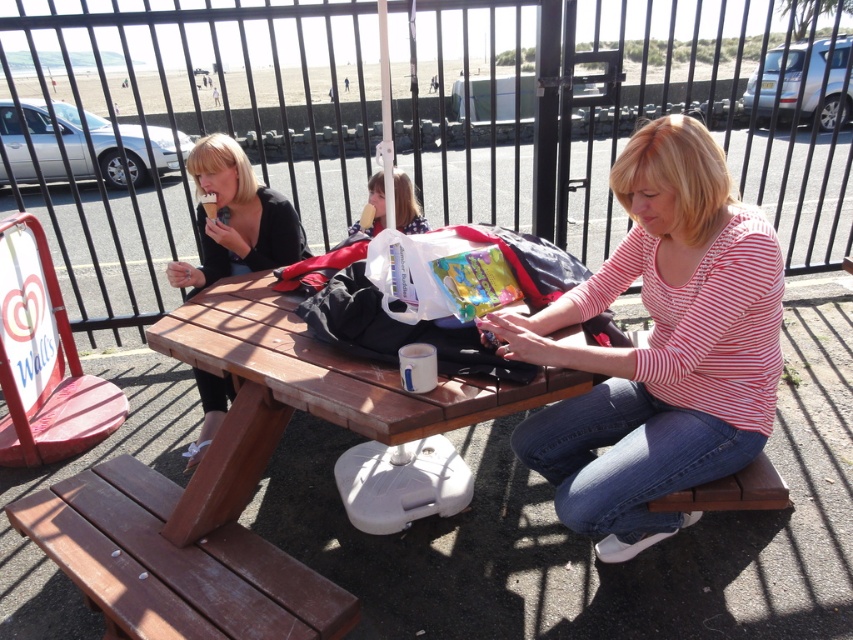
Between striped cotton shirt at center and brown wooden picnic table at center, which one is positioned higher?

striped cotton shirt at center is above.

Looking at this image, is striped cotton shirt at center bigger than brown wooden picnic table at center?

Incorrect, striped cotton shirt at center is not larger than brown wooden picnic table at center.

Between point (589, 468) and point (329, 394), which one is positioned behind?

Positioned behind is point (589, 468).

Identify the location of striped cotton shirt at center. This screenshot has width=853, height=640. (659, 348).

Is point (227, 212) farther from camera compared to point (372, 195)?

Yes, it is behind point (372, 195).

Is matte black ice cream cone at left to the right of matte plastic ice cream cone at center from the viewer's perspective?

In fact, matte black ice cream cone at left is to the left of matte plastic ice cream cone at center.

Consider the image. Measure the distance between matte black ice cream cone at left and camera.

7.41 feet

Where is `matte black ice cream cone at left`? This screenshot has height=640, width=853. matte black ice cream cone at left is located at coordinates (236, 218).

Who is positioned more to the right, brown wooden picnic table at center or brown wooden bench at lower center?

brown wooden bench at lower center is more to the right.

Between point (463, 424) and point (737, 492), which one is positioned in front?

Positioned in front is point (463, 424).

The image size is (853, 640). What do you see at coordinates (306, 392) in the screenshot?
I see `brown wooden picnic table at center` at bounding box center [306, 392].

The image size is (853, 640). Find the location of `brown wooden picnic table at center`. brown wooden picnic table at center is located at coordinates (306, 392).